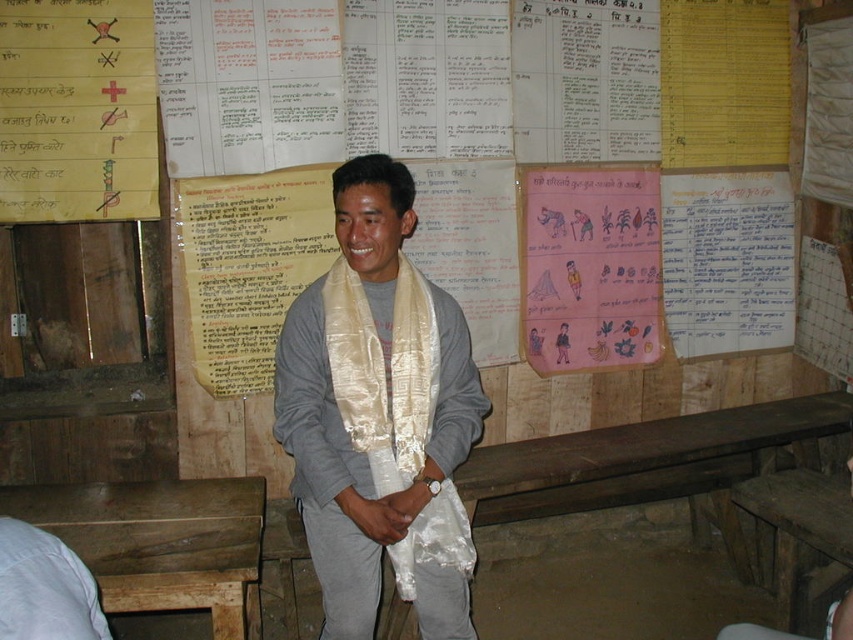
Question: Is silky beige scarf at center closer to the viewer compared to pink paper poster at center?

Choices:
 (A) yes
 (B) no

Answer: (A)

Question: Does pink paper poster at center appear on the right side of blue paper at upper right?

Choices:
 (A) yes
 (B) no

Answer: (B)

Question: Which object is the farthest from the silky beige scarf at center?

Choices:
 (A) blue paper at upper right
 (B) pink paper poster at center
 (C) light gray fabric at lower left

Answer: (A)

Question: Based on their relative distances, which object is nearer to the blue paper at upper right?

Choices:
 (A) silky beige scarf at center
 (B) light gray fabric at lower left

Answer: (A)

Question: Can you confirm if pink paper poster at center is positioned below light gray fabric at lower left?

Choices:
 (A) yes
 (B) no

Answer: (B)

Question: Among these points, which one is farthest from the camera?

Choices:
 (A) (55, 589)
 (B) (334, 294)

Answer: (B)